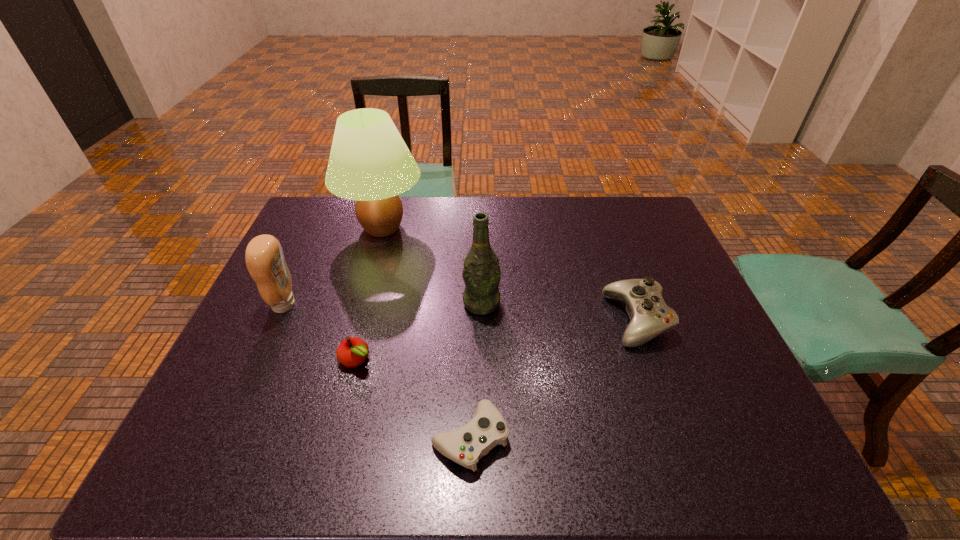
Locate an element on the screen. object present at the right edge is located at coordinates (650, 316).

At what (x,y) coordinates should I click in order to perform the action: click on object that is at the far left corner. Please return your answer as a coordinate pair (x, y). The width and height of the screenshot is (960, 540). Looking at the image, I should click on click(369, 162).

Image resolution: width=960 pixels, height=540 pixels. In the image, there is a desktop. Identify the location of vacant space at the far edge. click(501, 230).

In the image, there is a desktop. Identify the location of free space at the near edge. (605, 462).

In the image, there is a desktop. In order to click on blank space at the left edge in this screenshot , I will do `click(287, 323)`.

You are a GUI agent. You are given a task and a screenshot of the screen. Output one action in this format:
    pyautogui.click(x=<x>, y=<y>)
    Task: Click on the free region at the right edge
    
    Given the screenshot: What is the action you would take?
    pyautogui.click(x=700, y=408)

What are the coordinates of `free spot at the far right corner of the desktop` in the screenshot? It's located at (642, 208).

Image resolution: width=960 pixels, height=540 pixels. I want to click on vacant space at the near right corner of the desktop, so click(x=785, y=473).

Where is `free area in between the fourth shortest object and the apple`? free area in between the fourth shortest object and the apple is located at coordinates (321, 332).

Where is `empty space that is in between the fourth shortest object and the apple`? The image size is (960, 540). empty space that is in between the fourth shortest object and the apple is located at coordinates (321, 332).